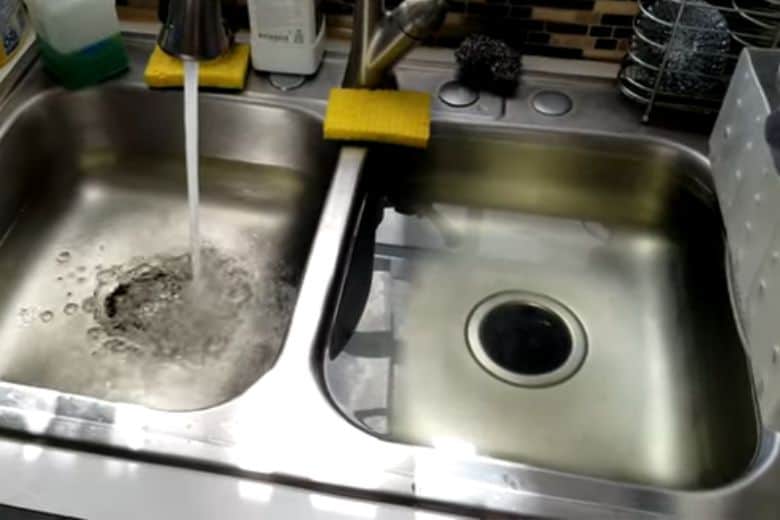
Locate an element on the screen. The image size is (780, 520). yellow rectangular sponges is located at coordinates (225, 59), (363, 111).